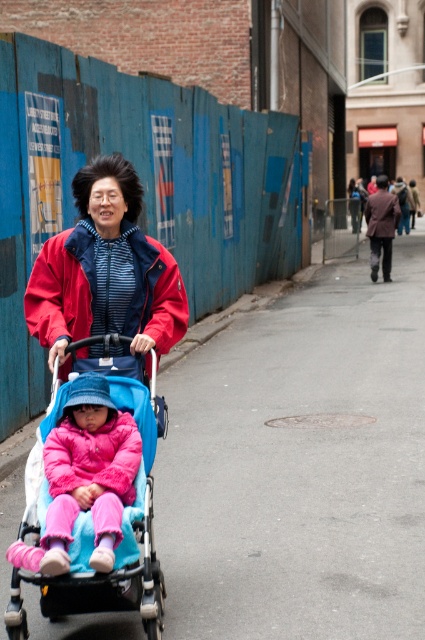
Between point (11, 595) and point (142, 310), which one is positioned in front?

Point (11, 595) is more forward.

Which is in front, point (85, 552) or point (139, 292)?

Point (85, 552)

The width and height of the screenshot is (425, 640). Identify the location of blue fabric stroller at center. (122, 552).